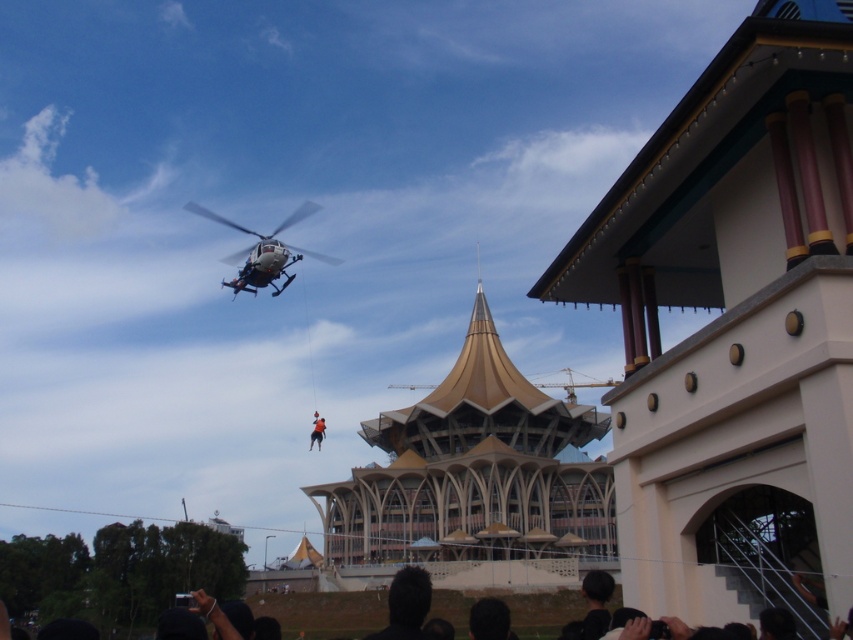
Question: Where is white painted stone temple at upper right located in relation to orange fabric person at center in the image?

Choices:
 (A) below
 (B) above

Answer: (B)

Question: Which object is closer to the camera taking this photo?

Choices:
 (A) beige concrete temple at center
 (B) orange fabric person at center

Answer: (A)

Question: Is beige concrete temple at center above white matte helicopter at upper center?

Choices:
 (A) no
 (B) yes

Answer: (A)

Question: Estimate the real-world distances between objects in this image. Which object is closer to the white matte helicopter at upper center?

Choices:
 (A) orange fabric person at center
 (B) white painted stone temple at upper right

Answer: (A)

Question: Which of these objects is positioned farthest from the white matte helicopter at upper center?

Choices:
 (A) white painted stone temple at upper right
 (B) beige concrete temple at center
 (C) black hair at lower center

Answer: (A)

Question: Is white matte helicopter at upper center to the left of orange fabric person at center from the viewer's perspective?

Choices:
 (A) no
 (B) yes

Answer: (B)